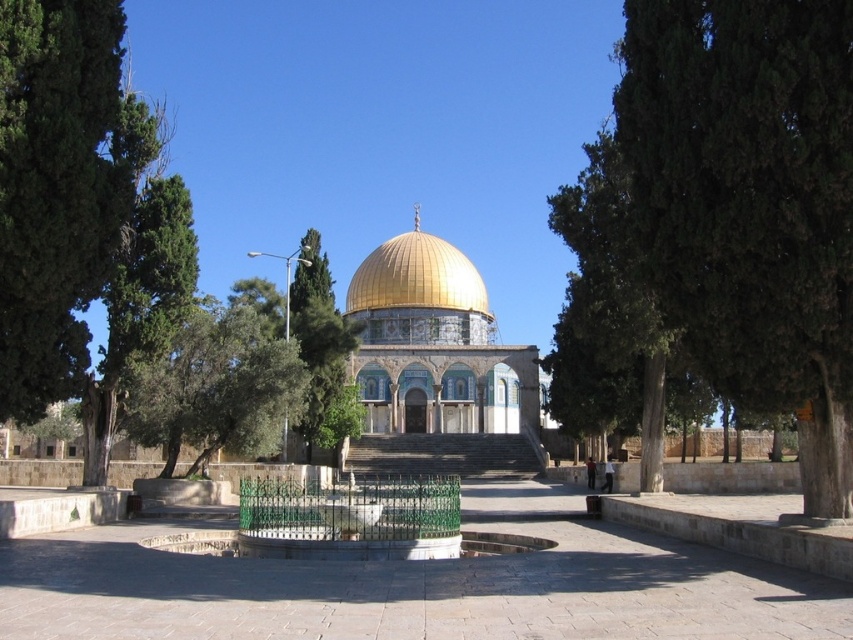
Is green leafy tree at left bigger than green leafy tree at center?

Incorrect, green leafy tree at left is not larger than green leafy tree at center.

Can you confirm if green leafy tree at left is smaller than green leafy tree at center?

Indeed, green leafy tree at left has a smaller size compared to green leafy tree at center.

The width and height of the screenshot is (853, 640). What do you see at coordinates (55, 189) in the screenshot?
I see `green leafy tree at left` at bounding box center [55, 189].

At what (x,y) coordinates should I click in order to perform the action: click on green leafy tree at left. Please return your answer as a coordinate pair (x, y). The height and width of the screenshot is (640, 853). Looking at the image, I should click on (55, 189).

Is green textured tree at right bigger than green leafy tree at left?

Yes, green textured tree at right is bigger than green leafy tree at left.

The image size is (853, 640). I want to click on green textured tree at right, so [720, 225].

Identify the location of green textured tree at right. (720, 225).

Is green textured tree at right positioned in front of gray stone stairs at center?

Yes, it is.

What do you see at coordinates (720, 225) in the screenshot? I see `green textured tree at right` at bounding box center [720, 225].

Locate an element on the screen. This screenshot has height=640, width=853. green textured tree at right is located at coordinates (720, 225).